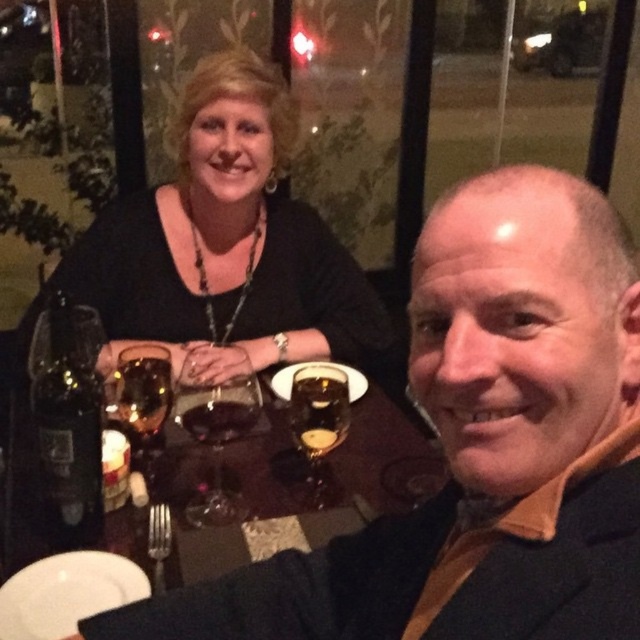
Between translucent amber glass at center and dark amber glass at center, which one has less height?

Standing shorter between the two is dark amber glass at center.

Where is `translucent amber glass at center`? The height and width of the screenshot is (640, 640). translucent amber glass at center is located at coordinates (145, 396).

Who is more distant from viewer, (166, 406) or (241, 412)?

The point (166, 406) is behind.

Locate an element on the screen. translucent amber glass at center is located at coordinates (145, 396).

Does dark wood table at center appear on the left side of translucent glass at center?

Correct, you'll find dark wood table at center to the left of translucent glass at center.

Find the location of a particular element. dark wood table at center is located at coordinates pyautogui.click(x=385, y=458).

Can you confirm if dark wood table at center is shorter than translucent glass wine at center?

Yes, dark wood table at center is shorter than translucent glass wine at center.

Which is more to the right, dark wood table at center or translucent glass wine at center?

dark wood table at center is more to the right.

Is point (412, 472) positioned behind point (260, 401)?

Yes, it is.

This screenshot has width=640, height=640. In order to click on dark wood table at center in this screenshot , I will do `click(385, 458)`.